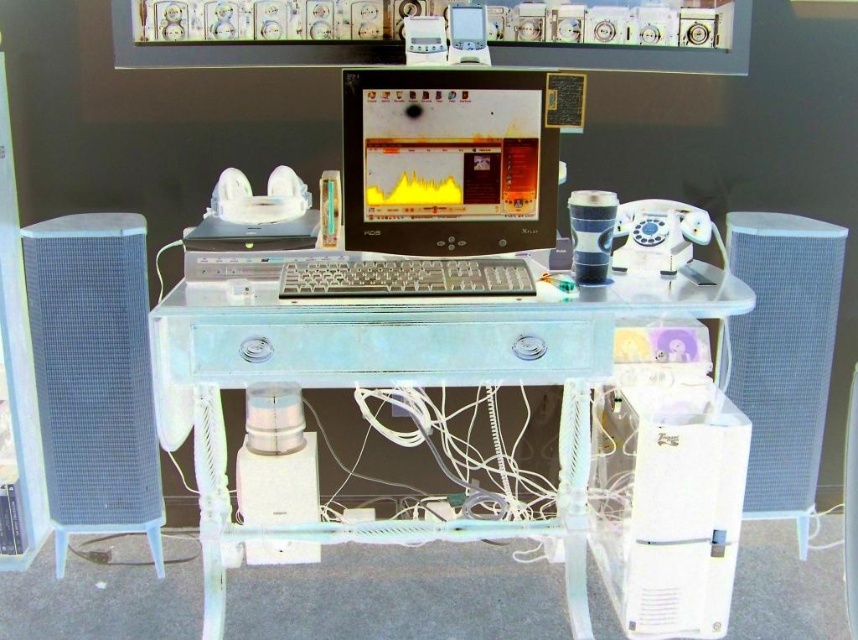
Does matte black monitor at center have a larger size compared to clear plastic keyboard at center?

Yes.

Is point (536, 170) farther from camera compared to point (399, 266)?

That is True.

Image resolution: width=858 pixels, height=640 pixels. What are the coordinates of `matte black monitor at center` in the screenshot? It's located at (446, 161).

Who is more forward, (402, 148) or (73, 515)?

Point (402, 148)

Looking at this image, is matte black monitor at center behind white mesh speaker at left?

No, matte black monitor at center is closer to the viewer.

Where is `matte black monitor at center`? matte black monitor at center is located at coordinates (446, 161).

Between matte black monitor at center and white plastic speaker at lower center, which one appears on the left side from the viewer's perspective?

From the viewer's perspective, white plastic speaker at lower center appears more on the left side.

Does matte black monitor at center have a lesser height compared to white plastic speaker at lower center?

In fact, matte black monitor at center may be taller than white plastic speaker at lower center.

Which is behind, point (349, 144) or point (317, 508)?

The point (317, 508) is behind.

You are a GUI agent. You are given a task and a screenshot of the screen. Output one action in this format:
    pyautogui.click(x=<x>, y=<y>)
    Task: Click on the matte black monitor at center
    This screenshot has width=858, height=640.
    Given the screenshot: What is the action you would take?
    pyautogui.click(x=446, y=161)